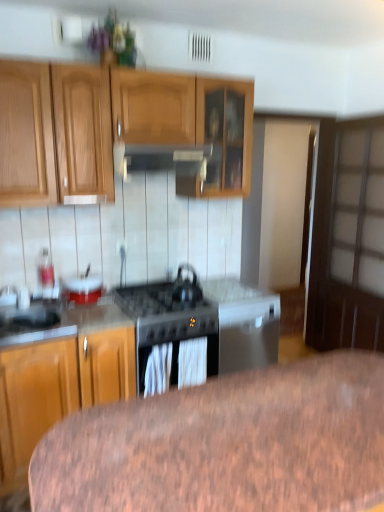
The width and height of the screenshot is (384, 512). I want to click on satin silver exhaust hood at upper center, so (162, 159).

Image resolution: width=384 pixels, height=512 pixels. Describe the element at coordinates (82, 288) in the screenshot. I see `white glossy bowl at center-left` at that location.

Image resolution: width=384 pixels, height=512 pixels. What do you see at coordinates (226, 444) in the screenshot? I see `brown wood table at lower center` at bounding box center [226, 444].

The image size is (384, 512). What do you see at coordinates (35, 323) in the screenshot? I see `satin silver sink at lower left` at bounding box center [35, 323].

I want to click on black matte gas stove at center, so click(x=169, y=309).

What are the coordinates of `satin silver exhaust hood at upper center` in the screenshot? It's located at (162, 159).

Who is taller, white glossy bowl at center-left or satin silver exhaust hood at upper center?

satin silver exhaust hood at upper center is taller.

Between white glossy bowl at center-left and satin silver exhaust hood at upper center, which one appears on the left side from the viewer's perspective?

From the viewer's perspective, white glossy bowl at center-left appears more on the left side.

Consider the image. From a real-world perspective, relative to satin silver exhaust hood at upper center, is white glossy bowl at center-left vertically above or below?

white glossy bowl at center-left is situated lower than satin silver exhaust hood at upper center in the real world.

Is white glossy bowl at center-left bigger or smaller than satin silver exhaust hood at upper center?

In the image, white glossy bowl at center-left appears to be smaller than satin silver exhaust hood at upper center.

Is black matte gas stove at center outside of black matte kettle at center?

black matte gas stove at center lies outside black matte kettle at center's area.

Which point is more distant from viewer, (184, 319) or (178, 274)?

Point (178, 274)

Is black matte gas stove at center to the right of black matte kettle at center from the viewer's perspective?

No, black matte gas stove at center is not to the right of black matte kettle at center.

From the image's perspective, which is below, satin silver sink at lower left or satin silver exhaust hood at upper center?

From the image's view, satin silver sink at lower left is below.

Is point (32, 317) less distant than point (122, 167)?

Yes, point (32, 317) is in front of point (122, 167).

Between satin silver sink at lower left and satin silver exhaust hood at upper center, which one appears on the left side from the viewer's perspective?

From the viewer's perspective, satin silver sink at lower left appears more on the left side.

Are satin silver sink at lower left and satin silver exhaust hood at upper center beside each other?

No, satin silver sink at lower left is not touching satin silver exhaust hood at upper center.

Is satin silver exhaust hood at upper center looking in the opposite direction of brown wood table at lower center?

satin silver exhaust hood at upper center does not have its back to brown wood table at lower center.

From their relative heights in the image, would you say satin silver exhaust hood at upper center is taller or shorter than brown wood table at lower center?

satin silver exhaust hood at upper center is shorter than brown wood table at lower center.

From a real-world perspective, which object rests below the other?

brown wood table at lower center is physically lower.

Is satin silver exhaust hood at upper center to the left of brown wood table at lower center from the viewer's perspective?

Correct, you'll find satin silver exhaust hood at upper center to the left of brown wood table at lower center.

From the picture: Does black matte kettle at center appear on the right side of black matte gas stove at center?

Correct, you'll find black matte kettle at center to the right of black matte gas stove at center.

From a real-world perspective, which is physically below, black matte kettle at center or black matte gas stove at center?

black matte gas stove at center, from a real-world perspective.

Does black matte kettle at center contain black matte gas stove at center?

No, black matte gas stove at center is located outside of black matte kettle at center.

Does black matte kettle at center come behind black matte gas stove at center?

That is True.

Which object is further away from the camera taking this photo, brown wood table at lower center or black matte gas stove at center?

black matte gas stove at center is behind.

Can you confirm if brown wood table at lower center is bigger than black matte gas stove at center?

Correct, brown wood table at lower center is larger in size than black matte gas stove at center.

Considering the relative sizes of brown wood table at lower center and black matte gas stove at center in the image provided, is brown wood table at lower center wider than black matte gas stove at center?

Yes.

From the image's perspective, does brown wood table at lower center appear lower than black matte gas stove at center?

Correct, brown wood table at lower center appears lower than black matte gas stove at center in the image.

Considering the sizes of objects black matte kettle at center and satin silver sink at lower left in the image provided, who is shorter, black matte kettle at center or satin silver sink at lower left?

satin silver sink at lower left.

The width and height of the screenshot is (384, 512). In order to click on sink on the left of black matte kettle at center in this screenshot , I will do `click(35, 323)`.

Identify the location of appliance located on the left of satin silver exhaust hood at upper center. This screenshot has width=384, height=512. (82, 288).

In the image, there is a black matte kettle at center. Identify the location of gas stove below it (from a real-world perspective). (169, 309).

Looking at the image, which one is located closer to white glossy bowl at center-left, brown wood table at lower center or satin silver sink at lower left?

satin silver sink at lower left is positioned closer to the anchor white glossy bowl at center-left.

Estimate the real-world distances between objects in this image. Which object is further from satin silver exhaust hood at upper center, black matte kettle at center or satin silver sink at lower left?

satin silver sink at lower left lies further to satin silver exhaust hood at upper center than the other object.

From the image, which object appears to be farther from black matte kettle at center, brown wood table at lower center or black matte gas stove at center?

brown wood table at lower center is further to black matte kettle at center.

Which object lies further to the anchor point white glossy bowl at center-left, black matte gas stove at center or black matte kettle at center?

Among the two, black matte kettle at center is located further to white glossy bowl at center-left.

Which object lies further to the anchor point satin silver exhaust hood at upper center, white glossy bowl at center-left or satin silver sink at lower left?

Based on the image, satin silver sink at lower left appears to be further to satin silver exhaust hood at upper center.

Based on their spatial positions, is black matte kettle at center or brown wood table at lower center closer to white glossy bowl at center-left?

Among the two, black matte kettle at center is located nearer to white glossy bowl at center-left.

Which object lies nearer to the anchor point black matte gas stove at center, black matte kettle at center or satin silver sink at lower left?

The object closer to black matte gas stove at center is black matte kettle at center.

Based on their spatial positions, is satin silver sink at lower left or black matte kettle at center closer to brown wood table at lower center?

Based on the image, black matte kettle at center appears to be nearer to brown wood table at lower center.

The height and width of the screenshot is (512, 384). Find the location of `sink between brown wood table at lower center and black matte kettle at center from front to back`. sink between brown wood table at lower center and black matte kettle at center from front to back is located at coordinates (35, 323).

Identify the location of kitchen appliance between satin silver exhaust hood at upper center and satin silver sink at lower left in the vertical direction. (186, 288).

Where is `appliance located between satin silver sink at lower left and black matte kettle at center in the left-right direction`? Image resolution: width=384 pixels, height=512 pixels. appliance located between satin silver sink at lower left and black matte kettle at center in the left-right direction is located at coordinates (82, 288).

Locate an element on the screen. exhaust hood positioned between brown wood table at lower center and black matte kettle at center from near to far is located at coordinates (162, 159).